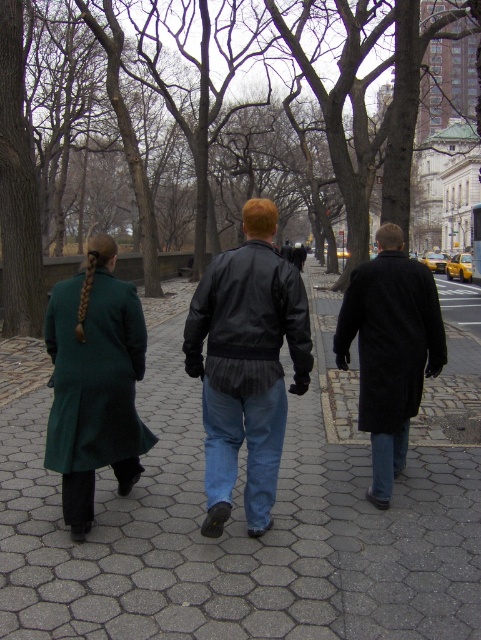
Between black leather jacket at center and jeans at lower right, which one is positioned higher?

black leather jacket at center is above.

Which is behind, point (226, 276) or point (382, 502)?

Point (382, 502)

Locate an element on the screen. This screenshot has height=640, width=481. black leather jacket at center is located at coordinates (248, 321).

Can you confirm if leather jacket at center is wider than dark wool coat at center?

Correct, the width of leather jacket at center exceeds that of dark wool coat at center.

Between leather jacket at center and dark wool coat at center, which one appears on the left side from the viewer's perspective?

leather jacket at center is more to the left.

What do you see at coordinates (247, 365) in the screenshot? This screenshot has height=640, width=481. I see `leather jacket at center` at bounding box center [247, 365].

Identify the location of leather jacket at center. (247, 365).

Is dark wool coat at center shorter than silky brown hair at center?

Incorrect, dark wool coat at center's height does not fall short of silky brown hair at center's.

The width and height of the screenshot is (481, 640). Describe the element at coordinates (390, 349) in the screenshot. I see `dark wool coat at center` at that location.

Does point (361, 339) come farther from viewer compared to point (85, 280)?

Yes.

Identify the location of dark wool coat at center. The image size is (481, 640). (390, 349).